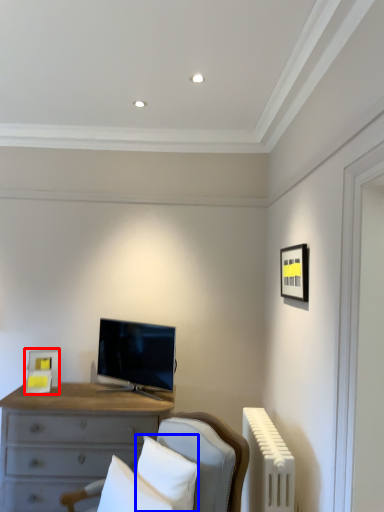
Question: Which object is further to the camera taking this photo, picture frame (highlighted by a red box) or pillow (highlighted by a blue box)?

Choices:
 (A) picture frame
 (B) pillow

Answer: (A)